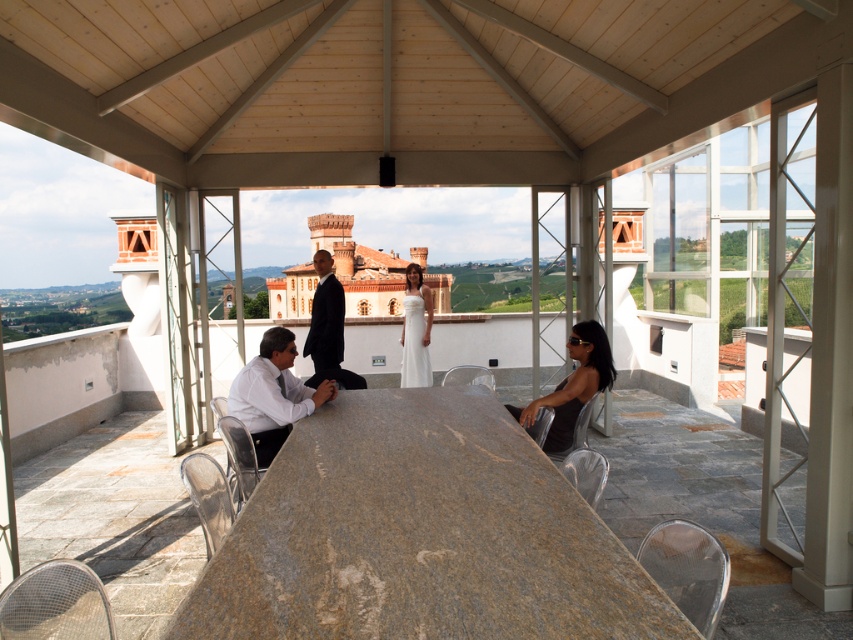
You are planning to take a photo of the group at the event. Considering the white glossy shirt at lower left and the black suit at center, which one should you focus on to ensure the subject takes up more of the frame?

The black suit at center should be focused on because it occupies more space than the white glossy shirt at lower left, making it a better subject for a larger presence in the photo.

You are a photographer at this event and need to ensure everyone is visible in the photo. Since the white glossy shirt at lower left and the black suit at center are at different heights, which one might be partially hidden if you take the photo from a lower angle?

The white glossy shirt at lower left is shorter than the black suit at center. If taking the photo from a lower angle, the shorter white glossy shirt at lower left might be partially hidden by the taller black suit at center.